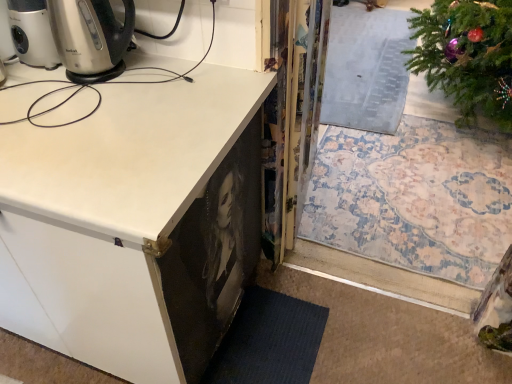
Where is `transparent plastic screen door at center`? Image resolution: width=512 pixels, height=384 pixels. transparent plastic screen door at center is located at coordinates (305, 105).

This screenshot has width=512, height=384. What do you see at coordinates (305, 105) in the screenshot?
I see `transparent plastic screen door at center` at bounding box center [305, 105].

Measure the distance between white matte cabinet at lower left and camera.

71.38 centimeters.

In order to face white matte cabinet at lower left, should I rotate leftwards or rightwards?

Turn left by 21.840 degrees to look at white matte cabinet at lower left.

Describe the element at coordinates (113, 214) in the screenshot. I see `white matte cabinet at lower left` at that location.

Locate an element on the screen. white matte cabinet at lower left is located at coordinates (113, 214).

Measure the distance between point (x=103, y=300) and camera.

96.50 centimeters.

Locate an element on the screen. Image resolution: width=512 pixels, height=384 pixels. transparent plastic screen door at center is located at coordinates (305, 105).

Considering the positions of objects transparent plastic screen door at center and white matte cabinet at lower left in the image provided, who is more to the left, transparent plastic screen door at center or white matte cabinet at lower left?

Positioned to the left is white matte cabinet at lower left.

Between transparent plastic screen door at center and white matte cabinet at lower left, which one is positioned in front?

white matte cabinet at lower left.

Between point (322, 49) and point (159, 303), which one is positioned in front?

The point (159, 303) is in front.

In the scene shown: From the image's perspective, between transparent plastic screen door at center and white matte cabinet at lower left, who is located below?

white matte cabinet at lower left, from the image's perspective.

Looking at this image, from a real-world perspective, which is physically above, transparent plastic screen door at center or white matte cabinet at lower left?

white matte cabinet at lower left, from a real-world perspective.

From the picture: Considering the sizes of transparent plastic screen door at center and white matte cabinet at lower left in the image, is transparent plastic screen door at center wider or thinner than white matte cabinet at lower left?

Clearly, transparent plastic screen door at center has less width compared to white matte cabinet at lower left.

Does transparent plastic screen door at center have a greater height compared to white matte cabinet at lower left?

No.

Is transparent plastic screen door at center bigger or smaller than white matte cabinet at lower left?

In the image, transparent plastic screen door at center appears to be smaller than white matte cabinet at lower left.

Would you say transparent plastic screen door at center is inside or outside white matte cabinet at lower left?

transparent plastic screen door at center is spatially situated outside white matte cabinet at lower left.

Is transparent plastic screen door at center next to white matte cabinet at lower left?

They are not placed beside each other.

Is transparent plastic screen door at center looking in the opposite direction of white matte cabinet at lower left?

Yes, transparent plastic screen door at center is facing away from white matte cabinet at lower left.

How much distance is there between transparent plastic screen door at center and white matte cabinet at lower left?

A distance of 27.93 inches exists between transparent plastic screen door at center and white matte cabinet at lower left.

The width and height of the screenshot is (512, 384). In order to click on screen door below the white matte cabinet at lower left (from a real-world perspective) in this screenshot , I will do `click(305, 105)`.

Looking at this image, considering the relative positions of white matte cabinet at lower left and transparent plastic screen door at center in the image provided, is white matte cabinet at lower left to the left or to the right of transparent plastic screen door at center?

In the image, white matte cabinet at lower left appears on the left side of transparent plastic screen door at center.

Between white matte cabinet at lower left and transparent plastic screen door at center, which one is positioned behind?

transparent plastic screen door at center is behind.

Is point (54, 227) in front of point (308, 95)?

That is True.

From the image's perspective, which is above, white matte cabinet at lower left or transparent plastic screen door at center?

transparent plastic screen door at center.

From a real-world perspective, does white matte cabinet at lower left sit lower than transparent plastic screen door at center?

No, from a real-world perspective, white matte cabinet at lower left is not beneath transparent plastic screen door at center.

Which object is wider, white matte cabinet at lower left or transparent plastic screen door at center?

white matte cabinet at lower left is wider.

Which of these two, white matte cabinet at lower left or transparent plastic screen door at center, stands taller?

With more height is white matte cabinet at lower left.

Can you confirm if white matte cabinet at lower left is smaller than transparent plastic screen door at center?

No.

Would you say white matte cabinet at lower left is outside transparent plastic screen door at center?

white matte cabinet at lower left is positioned outside transparent plastic screen door at center.

Can you see white matte cabinet at lower left touching transparent plastic screen door at center?

No, white matte cabinet at lower left is not in contact with transparent plastic screen door at center.

Is white matte cabinet at lower left looking in the opposite direction of transparent plastic screen door at center?

Yes, transparent plastic screen door at center is at the back of white matte cabinet at lower left.

Can you tell me how much white matte cabinet at lower left and transparent plastic screen door at center differ in facing direction?

The angular difference between white matte cabinet at lower left and transparent plastic screen door at center is 97.5 degrees.

How much distance is there between white matte cabinet at lower left and transparent plastic screen door at center?

white matte cabinet at lower left and transparent plastic screen door at center are 70.94 centimeters apart from each other.

You are a GUI agent. You are given a task and a screenshot of the screen. Output one action in this format:
    pyautogui.click(x=<x>, y=<y>)
    Task: Click on the screen door above the white matte cabinet at lower left (from the image's perspective)
    The height and width of the screenshot is (384, 512).
    Given the screenshot: What is the action you would take?
    pyautogui.click(x=305, y=105)

I want to click on cabinetry on the left of transparent plastic screen door at center, so click(113, 214).

The image size is (512, 384). In order to click on cabinetry located above the transparent plastic screen door at center (from a real-world perspective) in this screenshot , I will do `click(113, 214)`.